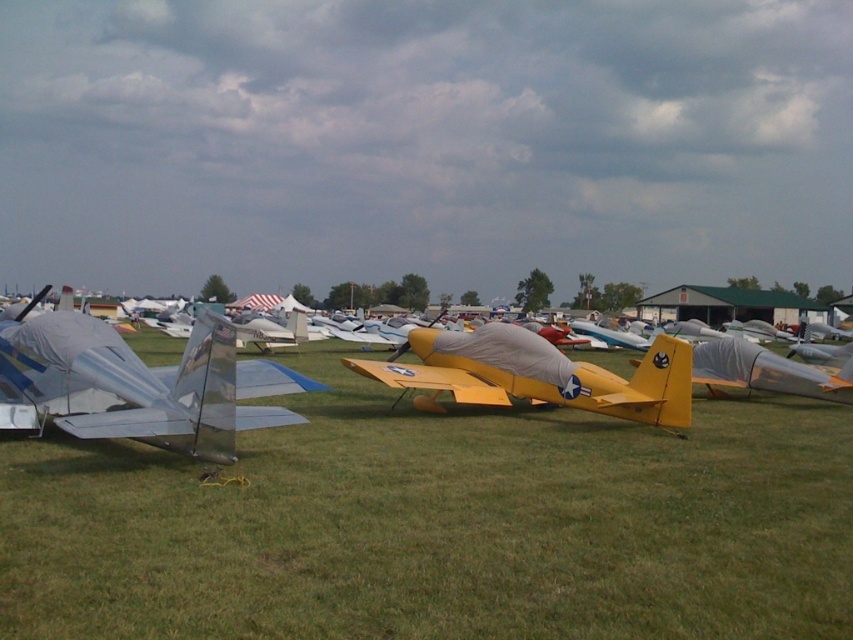
Question: Does metallic silver airplane at center appear on the right side of shiny silver airplane at left?

Choices:
 (A) yes
 (B) no

Answer: (A)

Question: Which of the following is the farthest from the observer?

Choices:
 (A) (515, 532)
 (B) (83, 365)

Answer: (B)

Question: Which point is closer to the camera taking this photo?

Choices:
 (A) (738, 480)
 (B) (76, 371)
 (C) (648, 360)
 (D) (215, 321)

Answer: (D)

Question: Can you confirm if shiny silver airplane at left is positioned above yellow matte airplane at center?

Choices:
 (A) no
 (B) yes

Answer: (B)

Question: Which point is closer to the camera?

Choices:
 (A) (454, 365)
 (B) (109, 387)

Answer: (B)

Question: Can you confirm if green grass at center is positioned above yellow matte airplane at center?

Choices:
 (A) no
 (B) yes

Answer: (A)